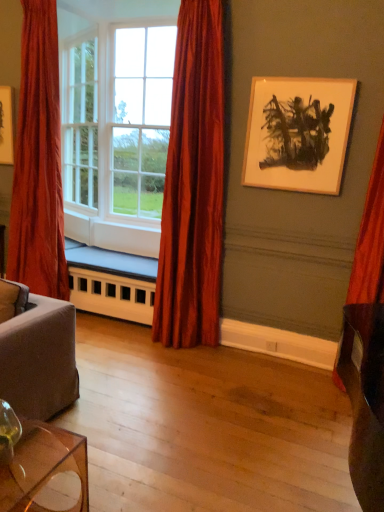
Question: Should I look upward or downward to see wooden picture frame at upper right?

Choices:
 (A) down
 (B) up

Answer: (B)

Question: From the image's perspective, is white painted wood radiator at lower center beneath velvet red curtain at right, acting as the 3th curtain starting from the left?

Choices:
 (A) yes
 (B) no

Answer: (A)

Question: Is velvet red curtain at right, acting as the 3th curtain starting from the left, at the back of white painted wood radiator at lower center?

Choices:
 (A) yes
 (B) no

Answer: (B)

Question: Is white painted wood radiator at lower center closer to the viewer compared to velvet red curtain at right, placed as the first curtain when sorted from right to left?

Choices:
 (A) no
 (B) yes

Answer: (A)

Question: Does white painted wood radiator at lower center have a greater height compared to velvet red curtain at right, acting as the 3th curtain starting from the left?

Choices:
 (A) no
 (B) yes

Answer: (A)

Question: Can you confirm if white painted wood radiator at lower center is positioned to the left of velvet red curtain at right, placed as the first curtain when sorted from right to left?

Choices:
 (A) yes
 (B) no

Answer: (A)

Question: Can you confirm if white painted wood radiator at lower center is thinner than velvet red curtain at right, acting as the 3th curtain starting from the left?

Choices:
 (A) no
 (B) yes

Answer: (A)

Question: Does velvet red curtain at right, placed as the first curtain when sorted from right to left, have a larger size compared to velvet red curtain at left, the 1th curtain positioned from the left?

Choices:
 (A) yes
 (B) no

Answer: (B)

Question: Is the surface of velvet red curtain at right, placed as the first curtain when sorted from right to left, in direct contact with velvet red curtain at left, placed as the third curtain when sorted from right to left?

Choices:
 (A) no
 (B) yes

Answer: (A)

Question: Does velvet red curtain at right, acting as the 3th curtain starting from the left, have a smaller size compared to velvet red curtain at left, the 1th curtain positioned from the left?

Choices:
 (A) no
 (B) yes

Answer: (B)

Question: Could you tell me if velvet red curtain at right, placed as the first curtain when sorted from right to left, is facing velvet red curtain at left, placed as the third curtain when sorted from right to left?

Choices:
 (A) no
 (B) yes

Answer: (A)

Question: From a real-world perspective, is velvet red curtain at right, acting as the 3th curtain starting from the left, located higher than velvet red curtain at left, placed as the third curtain when sorted from right to left?

Choices:
 (A) yes
 (B) no

Answer: (B)

Question: Is velvet red curtain at right, acting as the 3th curtain starting from the left, positioned far away from velvet red curtain at left, the 1th curtain positioned from the left?

Choices:
 (A) no
 (B) yes

Answer: (B)

Question: Does wooden picture frame at upper right have a larger size compared to velvet red curtain at right, acting as the 3th curtain starting from the left?

Choices:
 (A) no
 (B) yes

Answer: (A)